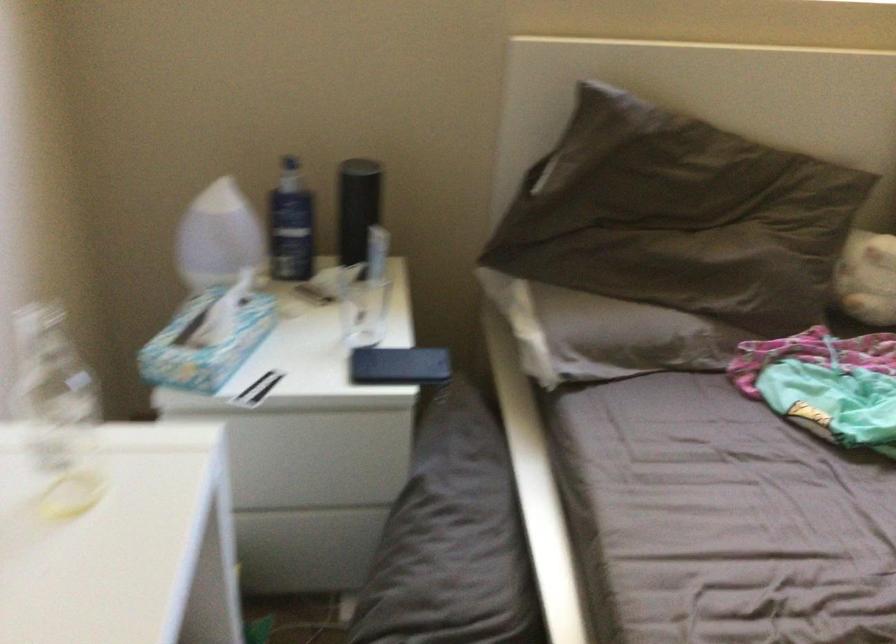
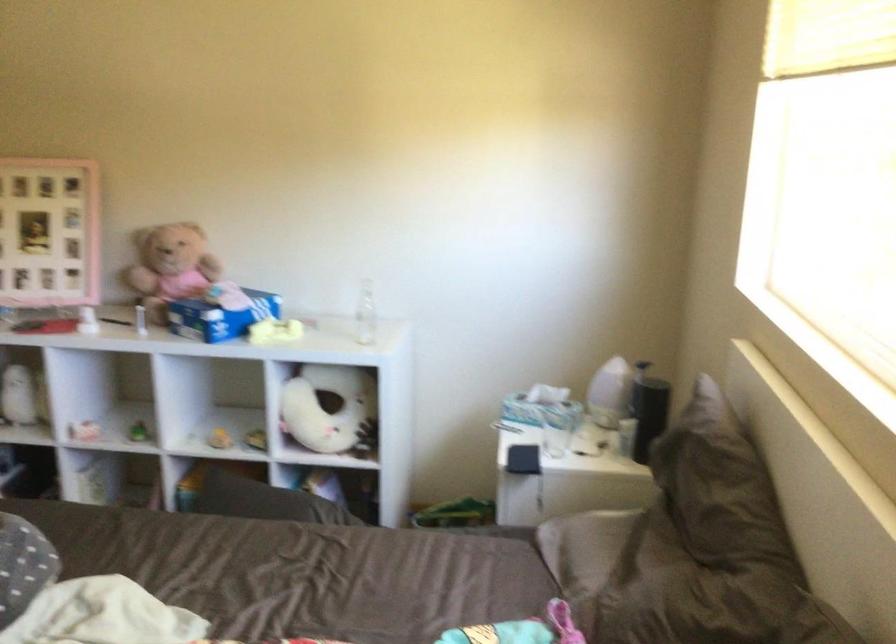
Locate, in the second image, the point that corresponds to point (298, 232) in the first image.

(613, 393)